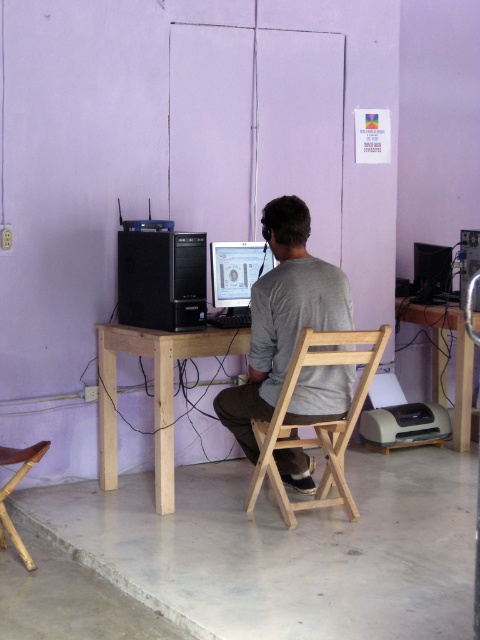
Does matte black computer desk at lower right lie behind bamboo chair at lower left?

Yes, matte black computer desk at lower right is behind bamboo chair at lower left.

Is matte black computer desk at lower right shorter than bamboo chair at lower left?

Incorrect, matte black computer desk at lower right's height does not fall short of bamboo chair at lower left's.

Is point (468, 392) closer to camera compared to point (0, 496)?

No, it is behind (0, 496).

Identify the location of matte black computer desk at lower right. Image resolution: width=480 pixels, height=640 pixels. (445, 360).

Which is more to the left, gray cotton shirt at center or bamboo chair at lower left?

From the viewer's perspective, bamboo chair at lower left appears more on the left side.

Between gray cotton shirt at center and bamboo chair at lower left, which one has less height?

Standing shorter between the two is bamboo chair at lower left.

Which is behind, point (310, 396) or point (12, 540)?

Positioned behind is point (310, 396).

You are a GUI agent. You are given a task and a screenshot of the screen. Output one action in this format:
    pyautogui.click(x=<x>, y=<y>)
    Task: Click on the gray cotton shirt at center
    This screenshot has width=480, height=640.
    Given the screenshot: What is the action you would take?
    pyautogui.click(x=283, y=316)

Looking at this image, can you confirm if light wood table at center is positioned to the right of matte black computer desk at lower right?

In fact, light wood table at center is to the left of matte black computer desk at lower right.

Does point (160, 456) lie in front of point (444, 353)?

That is True.

This screenshot has height=640, width=480. Find the location of `light wood table at center`. light wood table at center is located at coordinates (154, 392).